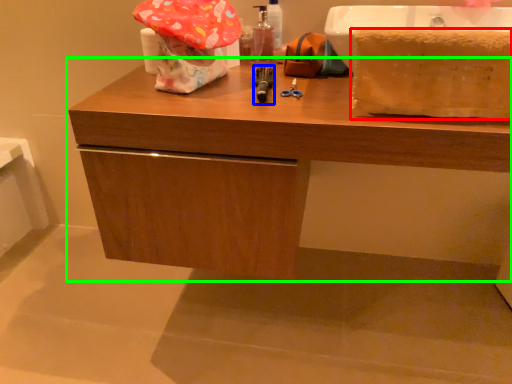
Question: Estimate the real-world distances between objects in this image. Which object is closer to blanket (highlighted by a red box), tool (highlighted by a blue box) or bathroom cabinet (highlighted by a green box)?

Choices:
 (A) tool
 (B) bathroom cabinet

Answer: (B)